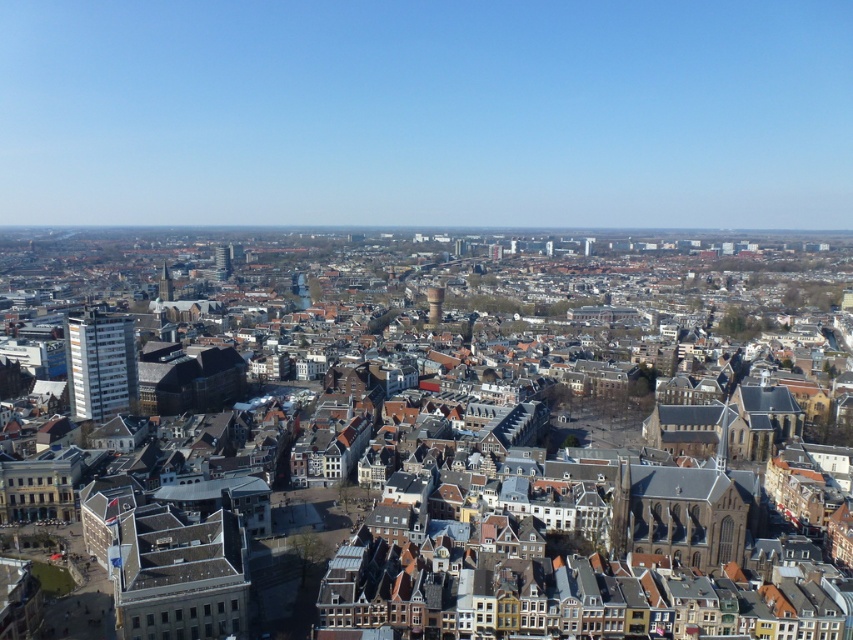
Question: Can you confirm if white glossy building at left is wider than dark gray stone tower at center-left?

Choices:
 (A) yes
 (B) no

Answer: (B)

Question: Among these objects, which one is farthest from the camera?

Choices:
 (A) white glossy building at left
 (B) dark gray stone tower at center-left

Answer: (B)

Question: Which of the following is the closest to the observer?

Choices:
 (A) matte gray tower at center
 (B) white glossy building at left

Answer: (B)

Question: Which point appears closest to the camera in this image?

Choices:
 (A) (223, 264)
 (B) (103, 380)
 (C) (163, 266)

Answer: (B)

Question: Can you confirm if white glossy building at left is bigger than dark gray stone tower at center-left?

Choices:
 (A) no
 (B) yes

Answer: (A)

Question: Is white glossy building at left bigger than dark gray stone tower at center-left?

Choices:
 (A) no
 (B) yes

Answer: (A)